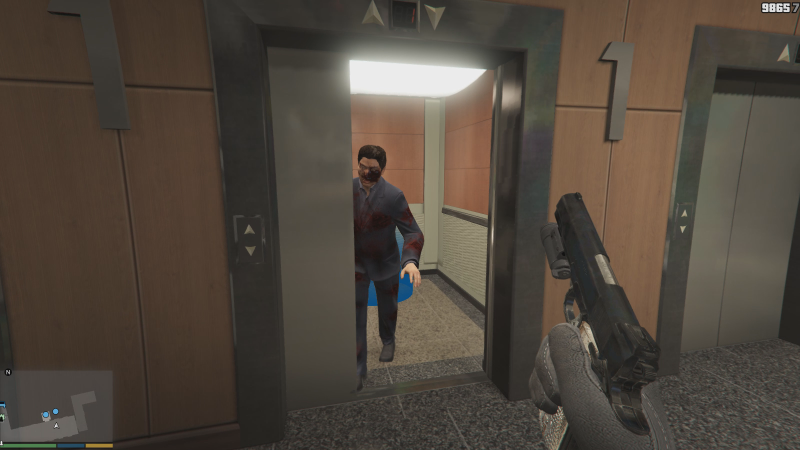
Where is `light`? This screenshot has height=450, width=800. light is located at coordinates (429, 84).